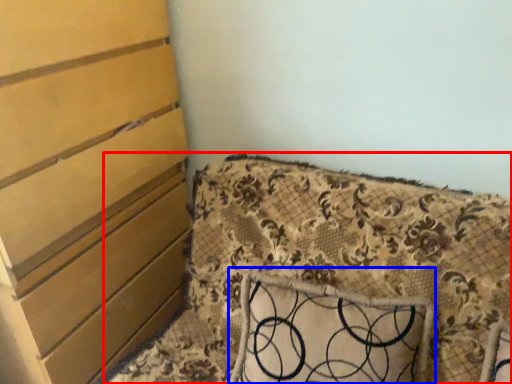
Question: Which object is closer to the camera taking this photo, furniture (highlighted by a red box) or pillow (highlighted by a blue box)?

Choices:
 (A) furniture
 (B) pillow

Answer: (A)